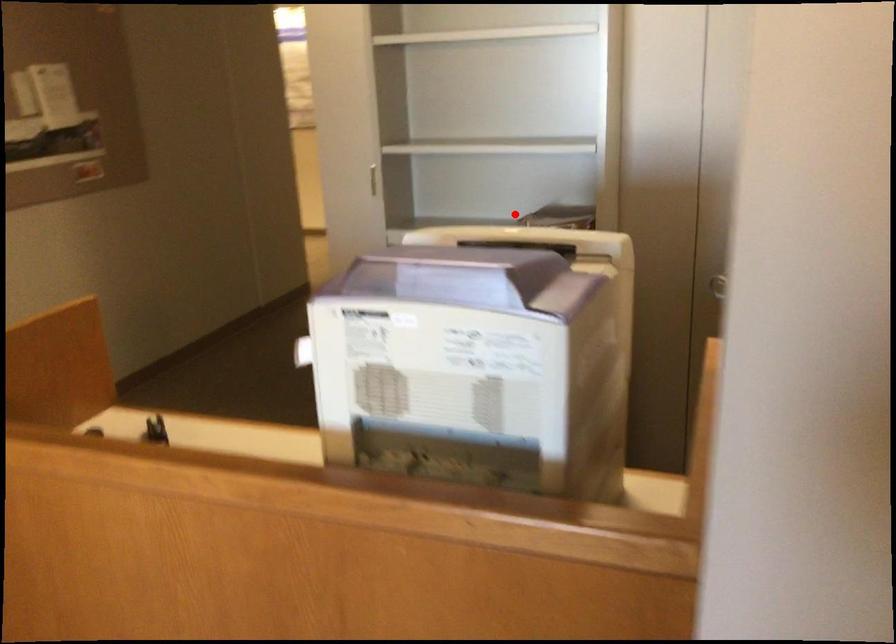
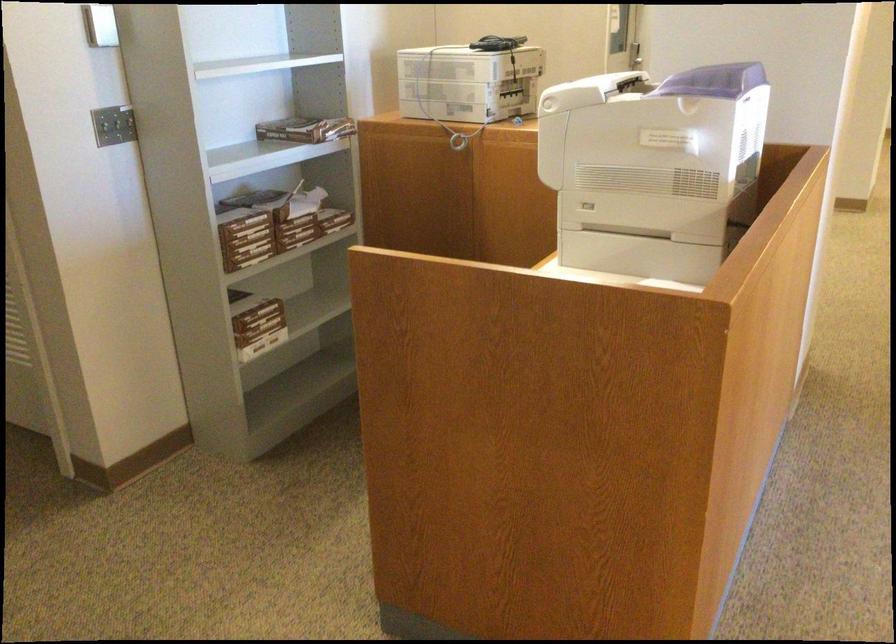
Where in the second image is the point corresponding to the highlighted location from the first image?

(306, 129)